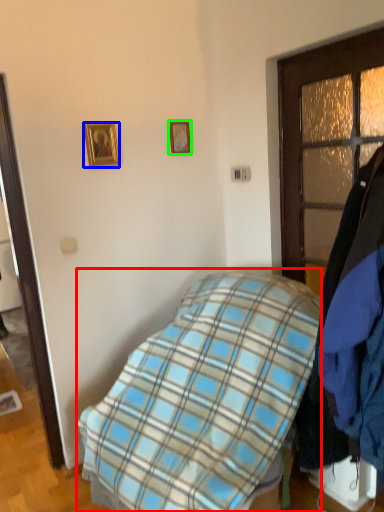
Question: Based on their relative distances, which object is farther from bed (highlighted by a red box)? Choose from picture frame (highlighted by a blue box) and picture frame (highlighted by a green box).

Choices:
 (A) picture frame
 (B) picture frame

Answer: (B)